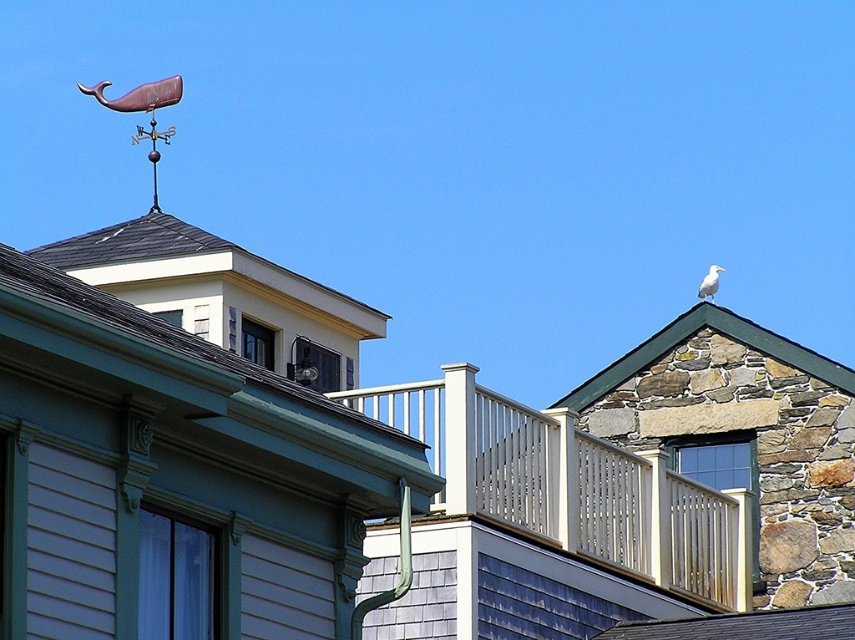
You are a birdwatcher observing the scene. You notice the shiny black shingles at upper center and the white feathered bird at upper right. Which object is taller in the image?

The white feathered bird at upper right is taller than the shiny black shingles at upper center.

You are standing in the architectural scene described. There is a point at coordinates (167,336). What can be found at that location?

At point (167,336) lies green shingles at upper center.